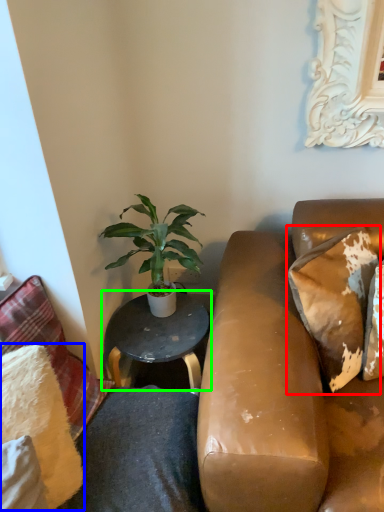
Question: Estimate the real-world distances between objects in this image. Which object is closer to pillow (highlighted by a red box), pillow (highlighted by a blue box) or table (highlighted by a green box)?

Choices:
 (A) pillow
 (B) table

Answer: (B)